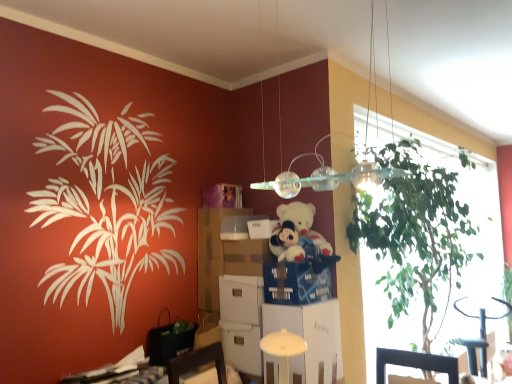
Question: Do you think white cardboard box at center is within white glossy round table at lower center, or outside of it?

Choices:
 (A) outside
 (B) inside

Answer: (A)

Question: In the image, is white cardboard box at center positioned in front of or behind white glossy round table at lower center?

Choices:
 (A) front
 (B) behind

Answer: (A)

Question: Which object is positioned closest to the white cardboard box at center, which is the 1th box from bottom to top?

Choices:
 (A) purple cardboard box at center, the third box when ordered from bottom to top
 (B) white glossy round table at lower center
 (C) white plush teddy bear at center
 (D) green leafy plant at upper right
 (E) cardboard drawer at center, the 1th drawer viewed from the left

Answer: (E)

Question: Based on their relative distances, which object is nearer to the white cardboard box at center, positioned as the 3th box in top-to-bottom order?

Choices:
 (A) white cardboard box at center
 (B) green leafy plant at upper right
 (C) white plush teddy bear at center
 (D) blue cardboard drawer at center, which appears as the 2th drawer when viewed from the left
 (E) cardboard drawer at center, the second drawer positioned from the right

Answer: (E)